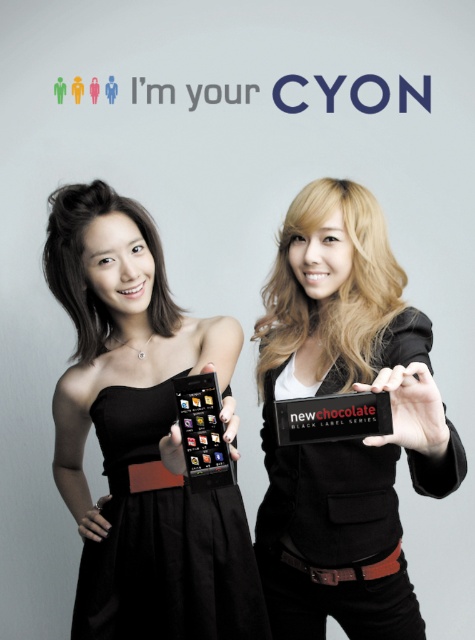
Between matte black card at right and matte black dress at center, which one appears on the left side from the viewer's perspective?

matte black dress at center is more to the left.

Who is more forward, (380,257) or (91,316)?

Point (380,257)

Find the location of a particular element. Image resolution: width=475 pixels, height=640 pixels. matte black card at right is located at coordinates (349, 440).

Between point (313, 616) and point (300, 332), which one is positioned in front?

Point (313, 616) is in front.

Identify the location of matte black card at right. This screenshot has width=475, height=640. (349, 440).

Between point (352, 196) and point (58, 296), which one is positioned behind?

The point (58, 296) is more distant.

The image size is (475, 640). Describe the element at coordinates (332, 291) in the screenshot. I see `matte black phone at left` at that location.

Locate an element on the screen. This screenshot has width=475, height=640. matte black phone at left is located at coordinates pyautogui.click(x=332, y=291).